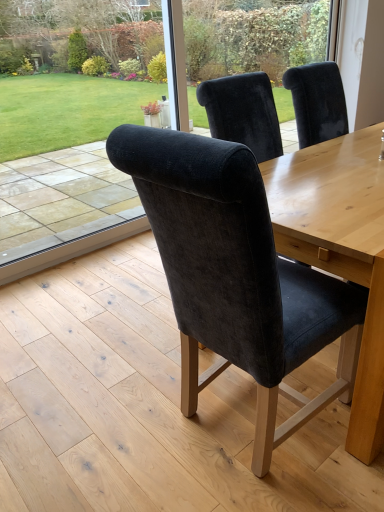
Where is `velvet chair back at center`? The height and width of the screenshot is (512, 384). velvet chair back at center is located at coordinates (85, 132).

Identify the location of velvet dark blue chair at center. (234, 274).

Find the location of a particular element. The height and width of the screenshot is (512, 384). transparent glass door at upper center is located at coordinates (253, 36).

Does point (171, 226) lie in front of point (187, 74)?

Yes, point (171, 226) is in front of point (187, 74).

Consider the image. Is transparent glass door at upper center completely or partially inside velvet dark blue chair at center?

No, transparent glass door at upper center is located outside of velvet dark blue chair at center.

From the image's perspective, is velvet dark blue chair at center under transparent glass door at upper center?

Yes, from the image's perspective, velvet dark blue chair at center is beneath transparent glass door at upper center.

Is velvet dark blue chair at center facing away from transparent glass door at upper center?

velvet dark blue chair at center does not have its back to transparent glass door at upper center.

Is transparent glass door at upper center behind velvet dark blue chair at center?

Yes, it is.

Is transparent glass door at upper center turned away from velvet dark blue chair at center?

No, velvet dark blue chair at center is not at the back of transparent glass door at upper center.

Does point (191, 53) come farther from viewer compared to point (218, 181)?

Yes, it is behind point (218, 181).

Identify the location of chair that appears below the transparent glass door at upper center (from a real-world perspective). The image size is (384, 512). (234, 274).

Can you confirm if velvet chair back at center is shorter than transparent glass door at upper center?

No, velvet chair back at center is not shorter than transparent glass door at upper center.

How distant is velvet chair back at center from transparent glass door at upper center?

They are 2.38 meters apart.

From a real-world perspective, is velvet chair back at center positioned above or below transparent glass door at upper center?

velvet chair back at center is situated lower than transparent glass door at upper center in the real world.

Considering the sizes of objects velvet chair back at center and velvet dark blue chair at center in the image provided, who is bigger, velvet chair back at center or velvet dark blue chair at center?

velvet dark blue chair at center.

Does velvet chair back at center have a lesser width compared to velvet dark blue chair at center?

Yes.

How much distance is there between velvet chair back at center and velvet dark blue chair at center?

velvet chair back at center and velvet dark blue chair at center are 8.91 feet apart from each other.

From the image's perspective, does velvet chair back at center appear higher than velvet dark blue chair at center?

Yes.

From the picture: Is velvet dark blue chair at center to the left of velvet chair back at center from the viewer's perspective?

In fact, velvet dark blue chair at center is to the right of velvet chair back at center.

Find the location of a particular element. chair below the velvet chair back at center (from the image's perspective) is located at coordinates (234, 274).

Is velvet dark blue chair at center next to velvet chair back at center?

No, velvet dark blue chair at center is not with velvet chair back at center.

Is velvet dark blue chair at center taller or shorter than velvet chair back at center?

Clearly, velvet dark blue chair at center is shorter compared to velvet chair back at center.

Is velvet chair back at center a part of transparent glass door at upper center?

Actually, velvet chair back at center is outside transparent glass door at upper center.

Does transparent glass door at upper center turn towards velvet chair back at center?

No, transparent glass door at upper center is not aimed at velvet chair back at center.

In the scene shown: From a real-world perspective, is transparent glass door at upper center located beneath velvet chair back at center?

No, from a real-world perspective, transparent glass door at upper center is not below velvet chair back at center.

Is transparent glass door at upper center wider or thinner than velvet chair back at center?

transparent glass door at upper center is thinner than velvet chair back at center.

The height and width of the screenshot is (512, 384). I want to click on chair in front of the transparent glass door at upper center, so coord(234,274).

You are a GUI agent. You are given a task and a screenshot of the screen. Output one action in this format:
    pyautogui.click(x=<x>, y=<y>)
    Task: Click on the chair located on the left of transparent glass door at upper center
    
    Given the screenshot: What is the action you would take?
    pyautogui.click(x=234, y=274)

From the image, which object appears to be farther from transparent glass door at upper center, velvet dark blue chair at center or velvet chair back at center?

Based on the image, velvet dark blue chair at center appears to be further to transparent glass door at upper center.

Considering their positions, is velvet chair back at center positioned further to velvet dark blue chair at center than transparent glass door at upper center?

transparent glass door at upper center.

Based on their spatial positions, is transparent glass door at upper center or velvet chair back at center further from velvet dark blue chair at center?

The object further to velvet dark blue chair at center is transparent glass door at upper center.

Based on their spatial positions, is velvet dark blue chair at center or transparent glass door at upper center further from velvet chair back at center?

velvet dark blue chair at center is positioned further to the anchor velvet chair back at center.

Consider the image. Considering their positions, is transparent glass door at upper center positioned closer to velvet chair back at center than velvet dark blue chair at center?

Based on the image, transparent glass door at upper center appears to be nearer to velvet chair back at center.

Which object lies further to the anchor point transparent glass door at upper center, velvet chair back at center or velvet dark blue chair at center?

Based on the image, velvet dark blue chair at center appears to be further to transparent glass door at upper center.

This screenshot has width=384, height=512. In order to click on window screen positioned between velvet dark blue chair at center and transparent glass door at upper center from near to far in this screenshot , I will do `click(85, 132)`.